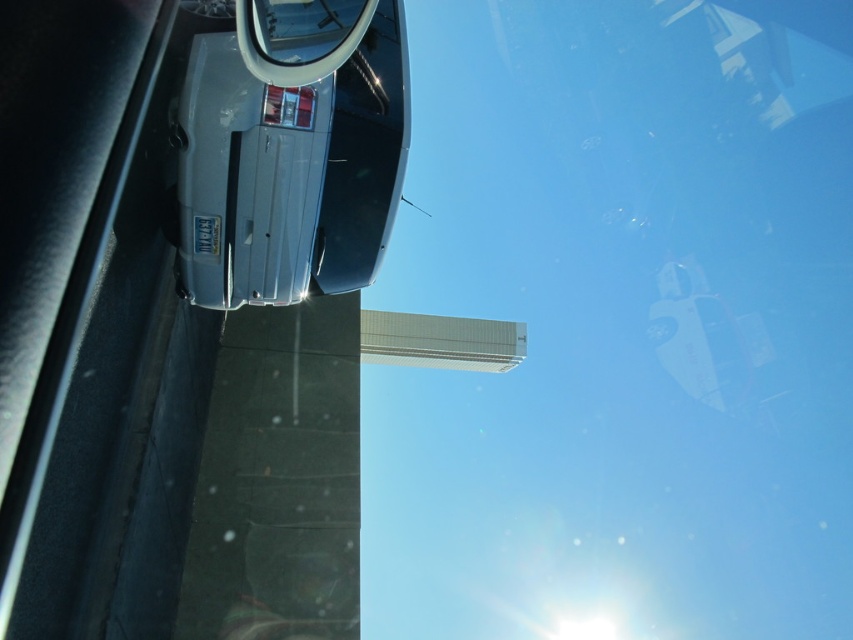
How much distance is there between satin silver car at upper left and clear glass rearview mirror at upper center?

A distance of 30.02 inches exists between satin silver car at upper left and clear glass rearview mirror at upper center.

Is point (248, 72) positioned after point (271, 76)?

Yes, it is.

Based on the photo, who is more distant from viewer, (277, 216) or (271, 10)?

The point (277, 216) is more distant.

This screenshot has height=640, width=853. Identify the location of satin silver car at upper left. (289, 150).